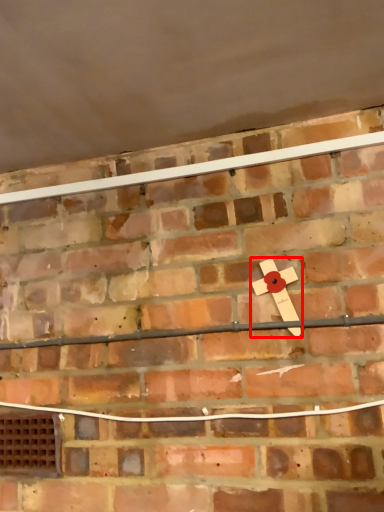
Question: Considering the relative positions of magnet (annotated by the red box) and window in the image provided, where is magnet (annotated by the red box) located with respect to the staircase?

Choices:
 (A) left
 (B) right

Answer: (B)